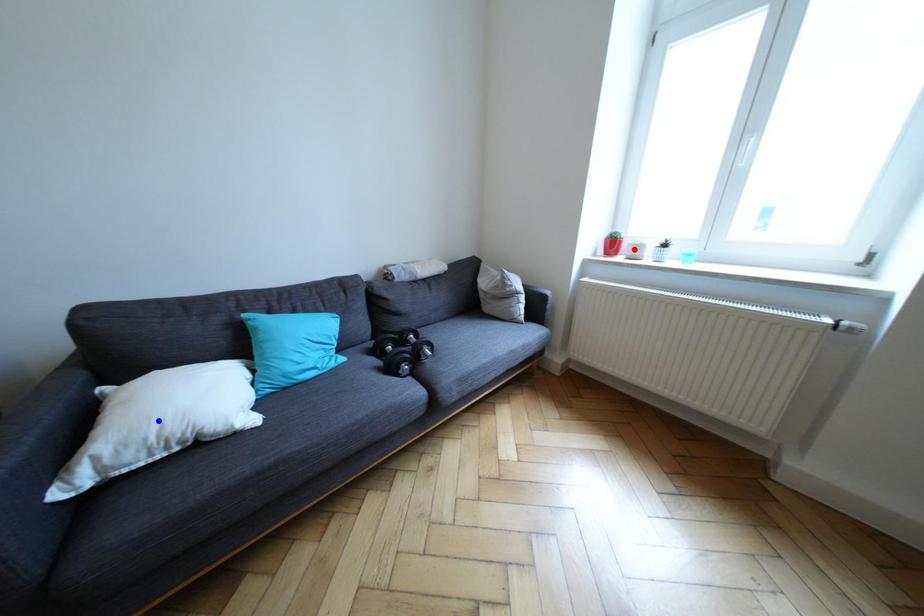
Question: Which of the two points in the image is closer to the camera?

Choices:
 (A) Blue point is closer.
 (B) Red point is closer.

Answer: (A)